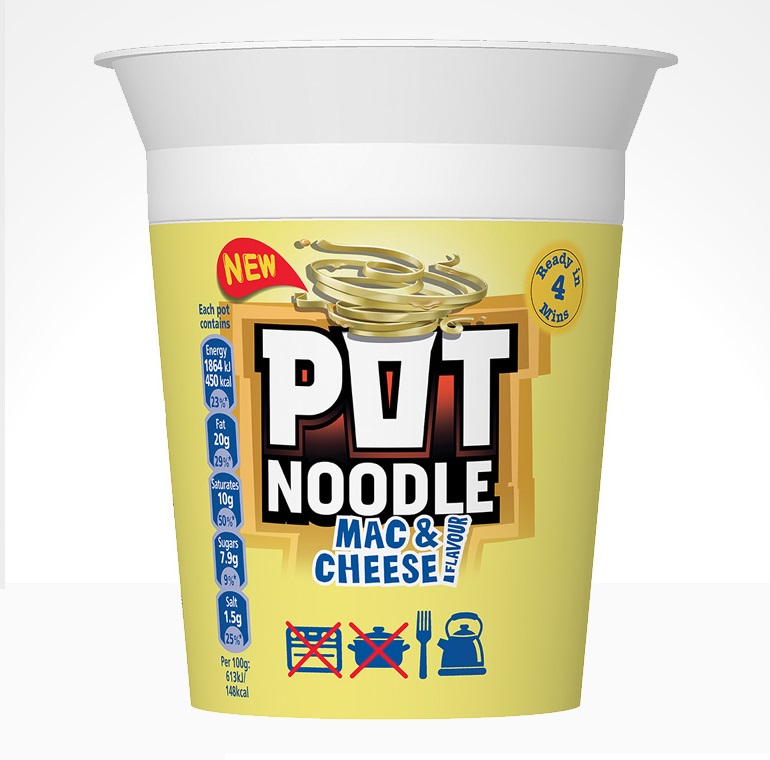
The image size is (770, 760). I want to click on kettle, so click(x=460, y=647).